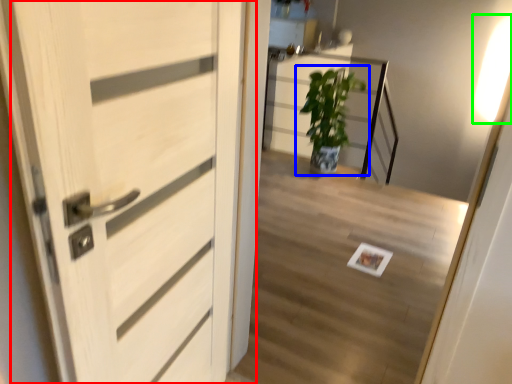
Question: Which object is the closest to the door (highlighted by a red box)? Choose among these: houseplant (highlighted by a blue box) or light (highlighted by a green box).

Choices:
 (A) houseplant
 (B) light

Answer: (A)